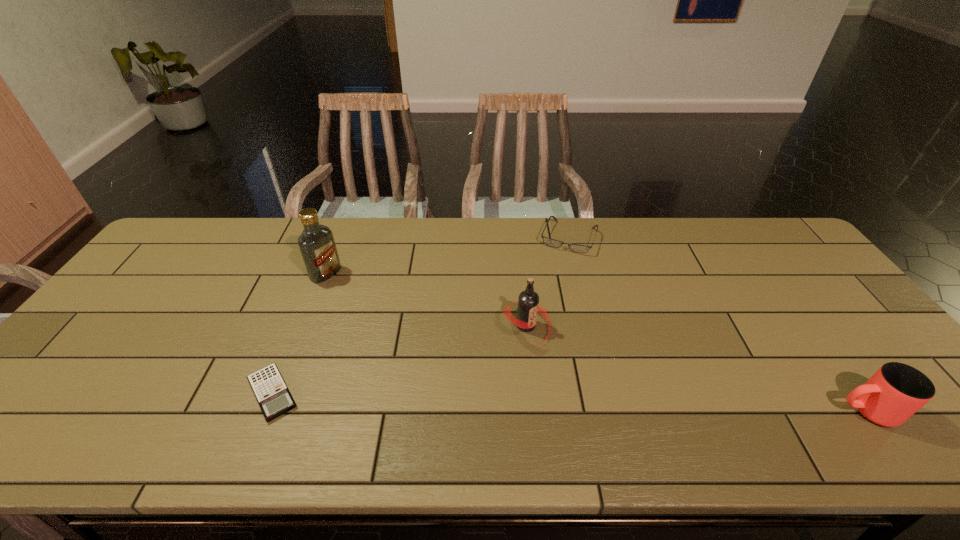
Find the location of `vacant point located on the front-facing side of the vodka`. vacant point located on the front-facing side of the vodka is located at coordinates (358, 293).

The image size is (960, 540). I want to click on free space located 0.370m on the front-facing side of the vodka, so click(x=429, y=335).

Identify the location of object that is at the far edge. (548, 241).

Identify the location of calculator located in the near edge section of the desktop. Image resolution: width=960 pixels, height=540 pixels. (274, 398).

The width and height of the screenshot is (960, 540). Find the location of `cup that is positioned at the near edge`. cup that is positioned at the near edge is located at coordinates (896, 391).

The image size is (960, 540). In order to click on object that is at the right edge in this screenshot , I will do `click(896, 391)`.

Locate an element on the screen. The height and width of the screenshot is (540, 960). object located in the near right corner section of the desktop is located at coordinates (896, 391).

Find the location of a particular element. vacant space at the far edge of the desktop is located at coordinates (576, 253).

You are a GUI agent. You are given a task and a screenshot of the screen. Output one action in this format:
    pyautogui.click(x=<x>, y=<y>)
    Task: Click on the free space at the near edge of the desktop
    This screenshot has height=540, width=960.
    Given the screenshot: What is the action you would take?
    pyautogui.click(x=574, y=381)

This screenshot has width=960, height=540. I want to click on free location at the left edge of the desktop, so click(93, 327).